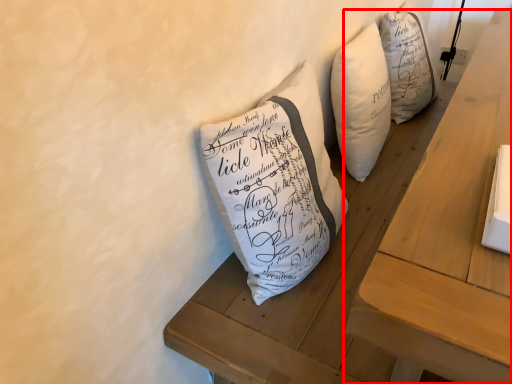
Question: From the image, what is the correct spatial relationship of table (annotated by the red box) in relation to furniture?

Choices:
 (A) left
 (B) right

Answer: (B)